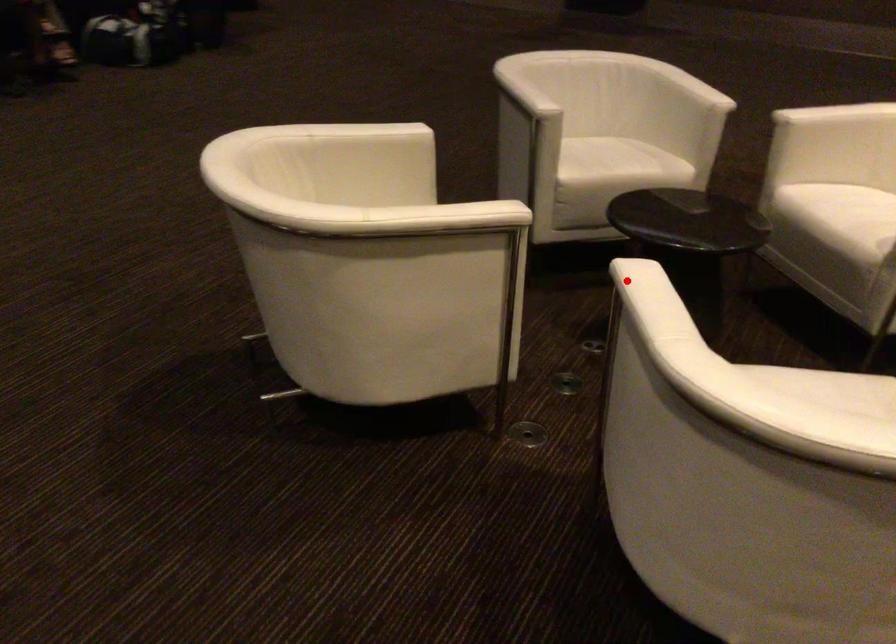
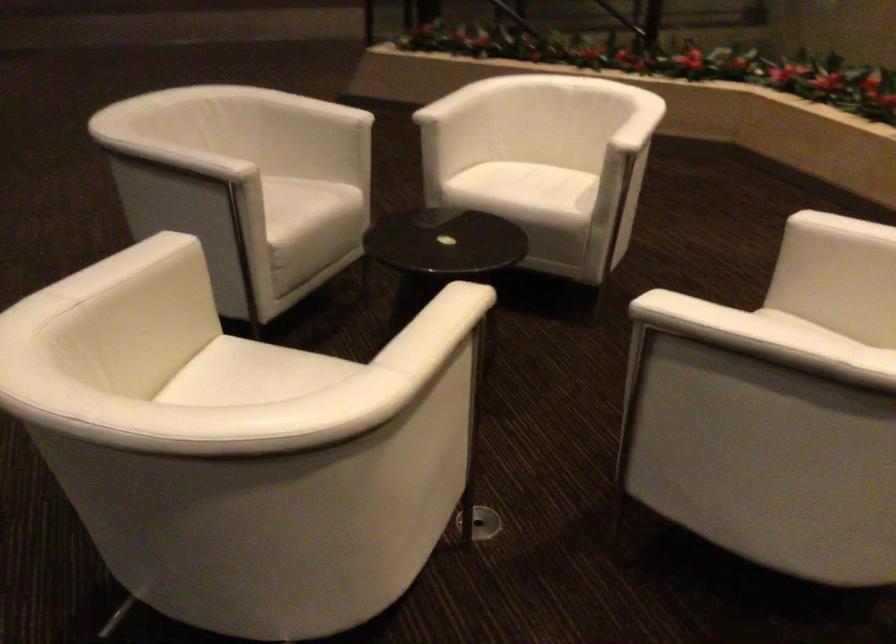
The point at the highlighted location is marked in the first image. Where is the corresponding point in the second image?

(694, 317)